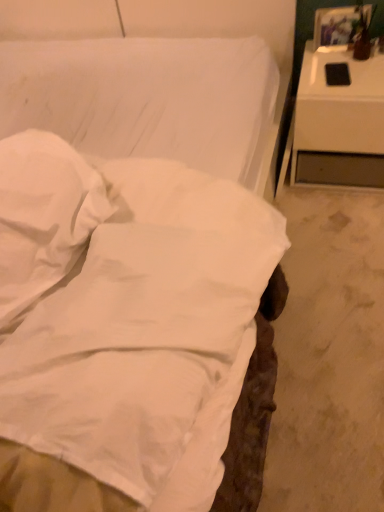
The image size is (384, 512). I want to click on blank space above white glossy nightstand at right (from a real-world perspective), so click(345, 59).